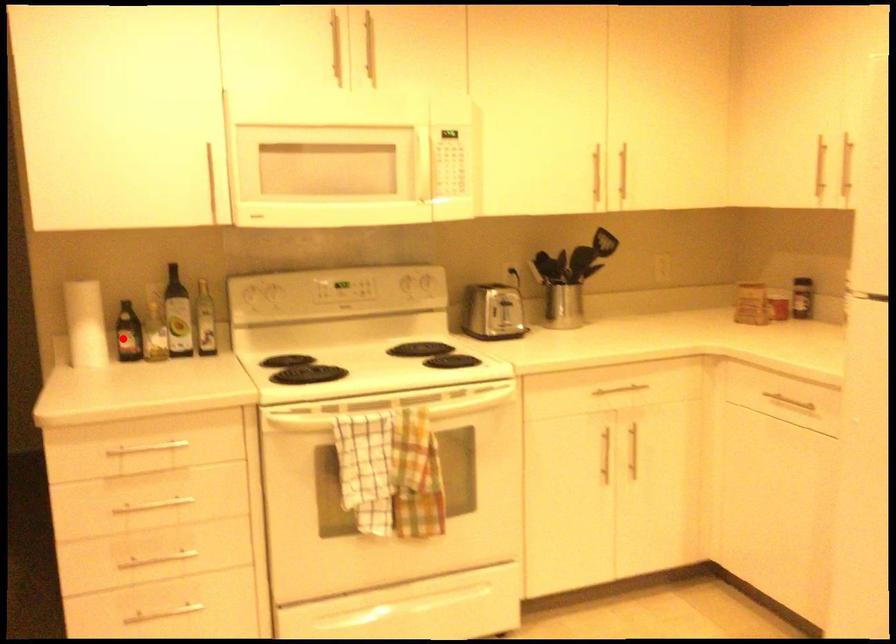
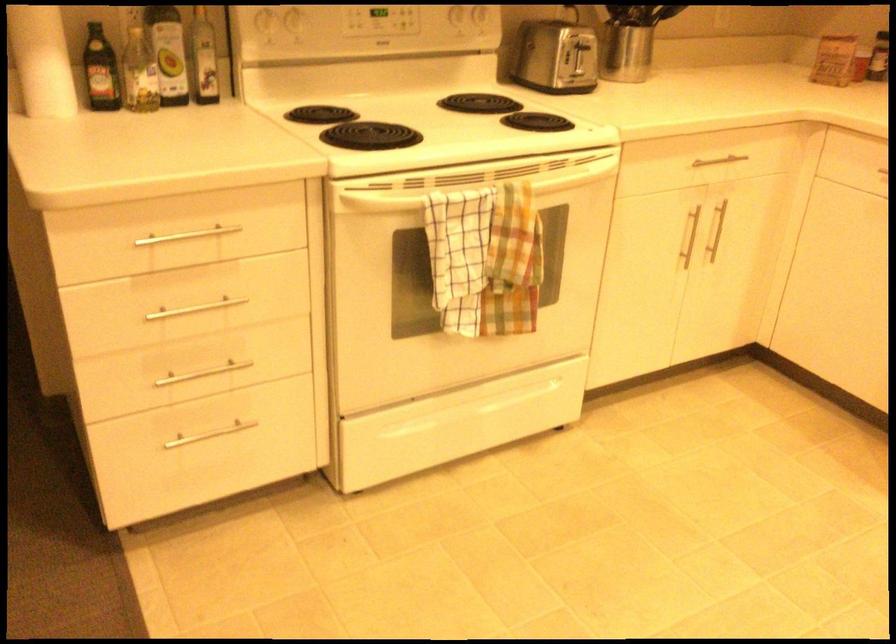
Question: I am providing you with two images of the same scene from different viewpoints. Given a red point in image1, look at the same physical point in image2. Is it:

Choices:
 (A) Closer to the viewpoint
 (B) Farther from the viewpoint

Answer: (A)